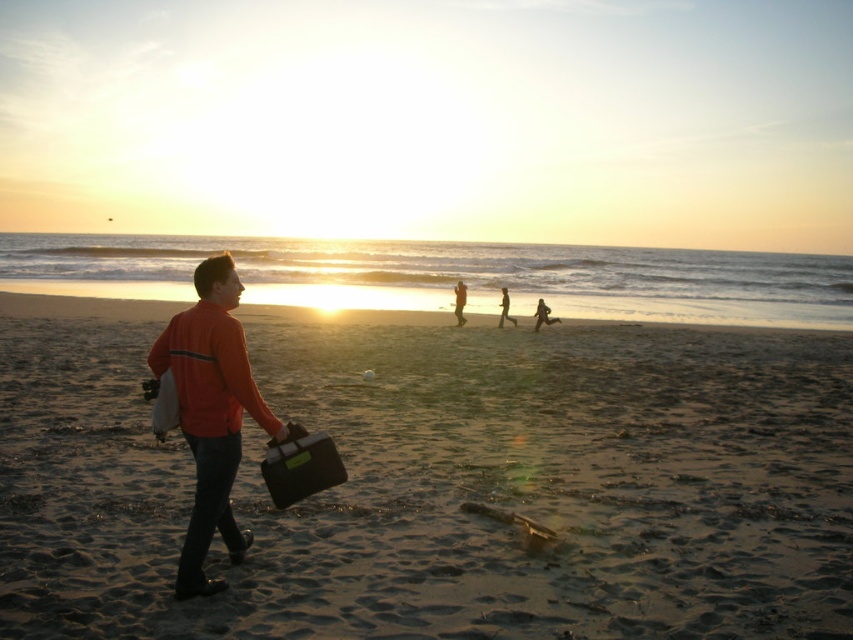
Question: Is orange matte jacket at center positioned in front of orange fabric pants at center?

Choices:
 (A) yes
 (B) no

Answer: (A)

Question: Does sandy brown at center appear on the left side of orange fabric pants at center?

Choices:
 (A) no
 (B) yes

Answer: (B)

Question: Which of the following is the farthest from the observer?

Choices:
 (A) orange fabric pants at center
 (B) orange matte jacket at center
 (C) sandy brown at center

Answer: (A)

Question: Which object is the farthest from the orange fabric pants at center?

Choices:
 (A) sandy brown at center
 (B) orange matte jacket at center

Answer: (B)

Question: Does sandy brown at center appear on the left side of orange fabric pants at center?

Choices:
 (A) yes
 (B) no

Answer: (A)

Question: Which object appears farthest from the camera in this image?

Choices:
 (A) orange fabric pants at center
 (B) orange matte jacket at center

Answer: (A)